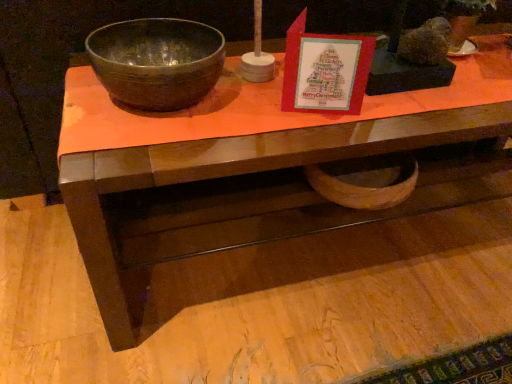
Where is `unoccupied region to the right of matte brown bowl at left`? This screenshot has width=512, height=384. unoccupied region to the right of matte brown bowl at left is located at coordinates (264, 110).